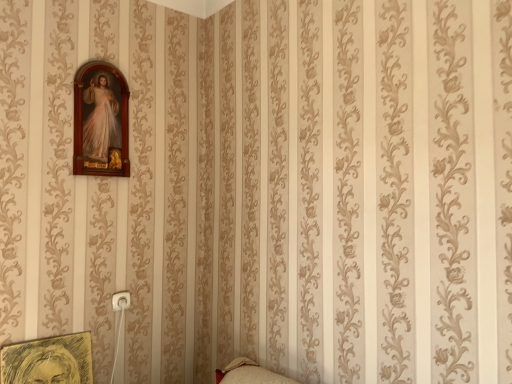
Question: From a real-world perspective, is wooden picture frame at upper left, which is the first picture frame in top-to-bottom order, on yellow sketchbook at lower left, marked as the first picture frame in a bottom-to-top arrangement?

Choices:
 (A) no
 (B) yes

Answer: (B)

Question: Is wooden picture frame at upper left, which is the first picture frame in top-to-bottom order, not inside yellow sketchbook at lower left, which is the second picture frame from top to bottom?

Choices:
 (A) yes
 (B) no

Answer: (A)

Question: Would you say wooden picture frame at upper left, which is the first picture frame in top-to-bottom order, is a long distance from yellow sketchbook at lower left, marked as the first picture frame in a bottom-to-top arrangement?

Choices:
 (A) no
 (B) yes

Answer: (A)

Question: From a real-world perspective, does wooden picture frame at upper left, which is the first picture frame in top-to-bottom order, sit lower than yellow sketchbook at lower left, marked as the first picture frame in a bottom-to-top arrangement?

Choices:
 (A) no
 (B) yes

Answer: (A)

Question: From the image's perspective, is wooden picture frame at upper left, which is counted as the 2th picture frame, starting from the bottom, on top of yellow sketchbook at lower left, which is the second picture frame from top to bottom?

Choices:
 (A) yes
 (B) no

Answer: (A)

Question: Can you confirm if wooden picture frame at upper left, which is the first picture frame in top-to-bottom order, is wider than yellow sketchbook at lower left, which is the second picture frame from top to bottom?

Choices:
 (A) no
 (B) yes

Answer: (A)

Question: From a real-world perspective, is yellow sketchbook at lower left, marked as the first picture frame in a bottom-to-top arrangement, located beneath wooden picture frame at upper left, which is counted as the 2th picture frame, starting from the bottom?

Choices:
 (A) yes
 (B) no

Answer: (A)

Question: Does yellow sketchbook at lower left, marked as the first picture frame in a bottom-to-top arrangement, have a smaller size compared to wooden picture frame at upper left, which is counted as the 2th picture frame, starting from the bottom?

Choices:
 (A) no
 (B) yes

Answer: (B)

Question: Is yellow sketchbook at lower left, which is the second picture frame from top to bottom, behind wooden picture frame at upper left, which is counted as the 2th picture frame, starting from the bottom?

Choices:
 (A) no
 (B) yes

Answer: (A)

Question: Does yellow sketchbook at lower left, marked as the first picture frame in a bottom-to-top arrangement, appear on the left side of wooden picture frame at upper left, which is counted as the 2th picture frame, starting from the bottom?

Choices:
 (A) yes
 (B) no

Answer: (A)

Question: Can you confirm if yellow sketchbook at lower left, marked as the first picture frame in a bottom-to-top arrangement, is positioned to the right of wooden picture frame at upper left, which is the first picture frame in top-to-bottom order?

Choices:
 (A) yes
 (B) no

Answer: (B)

Question: From the image's perspective, is yellow sketchbook at lower left, which is the second picture frame from top to bottom, located beneath wooden picture frame at upper left, which is the first picture frame in top-to-bottom order?

Choices:
 (A) yes
 (B) no

Answer: (A)

Question: From the image's perspective, is yellow sketchbook at lower left, marked as the first picture frame in a bottom-to-top arrangement, located above or below wooden picture frame at upper left, which is the first picture frame in top-to-bottom order?

Choices:
 (A) above
 (B) below

Answer: (B)